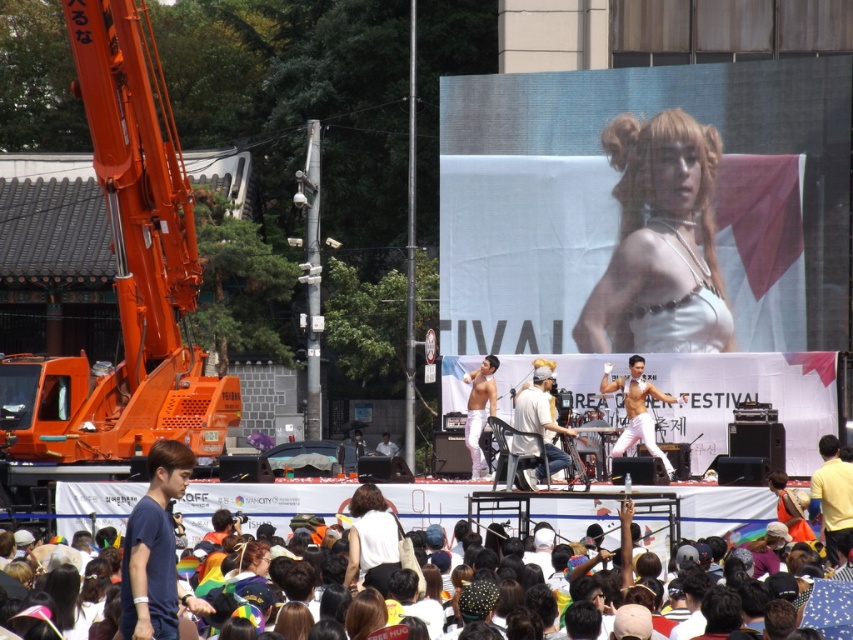
From the picture: You are a photographer at the festival and want to capture a photo of both the yellow cotton shirt at center and the white cotton shirt at center. Which shirt should you focus on first if you want to include both in the frame without cropping?

The yellow cotton shirt at center is shorter than the white cotton shirt at center, so you should focus on the white cotton shirt at center first to ensure both shirts are fully visible in the frame.